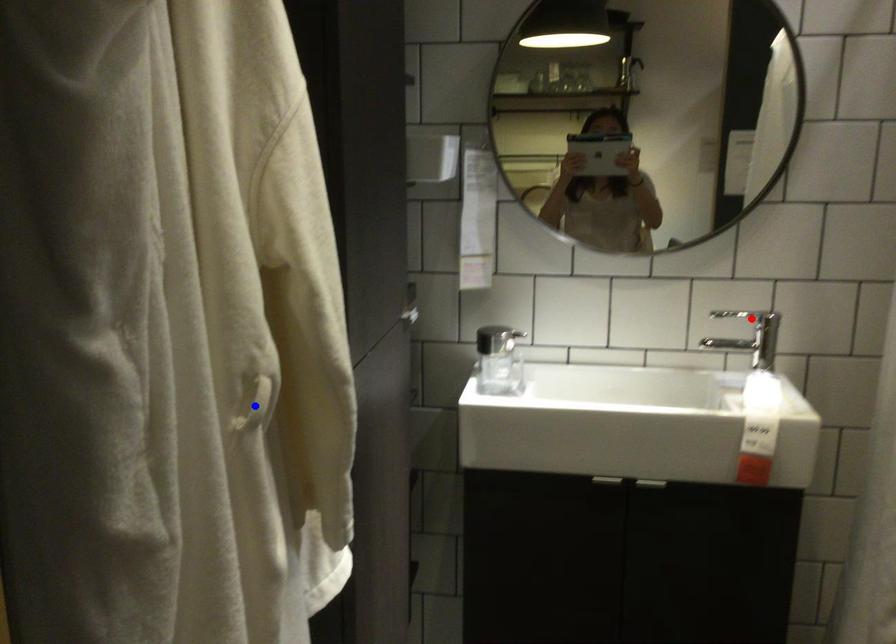
Question: Which of the two points in the image is closer to the camera?

Choices:
 (A) Blue point is closer.
 (B) Red point is closer.

Answer: (A)